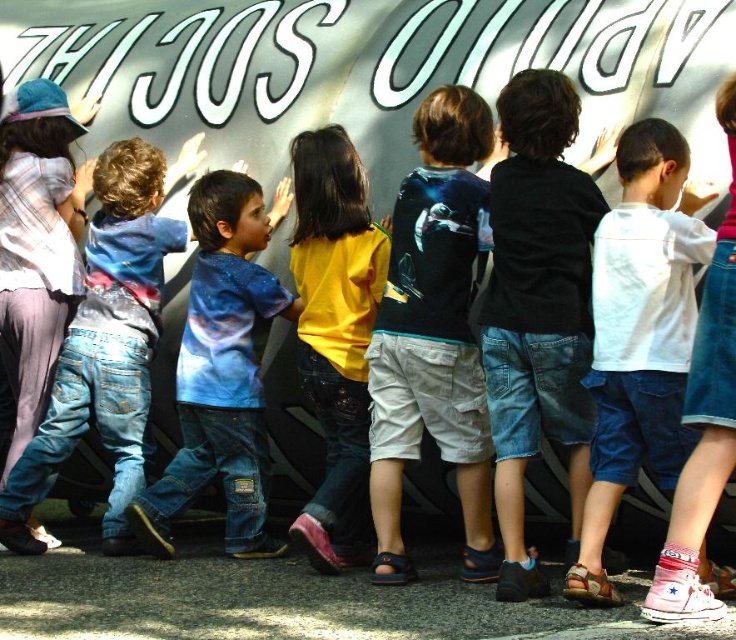
Question: Among these objects, which one is farthest from the camera?

Choices:
 (A) plaid shirt at left
 (B) dark blue t-shirt at center

Answer: (A)

Question: Where is white cotton shirt at center located in relation to denim jeans at left in the image?

Choices:
 (A) left
 (B) right

Answer: (B)

Question: Does white cotton shirt at center lie in front of blue galaxy print shirt at center?

Choices:
 (A) yes
 (B) no

Answer: (A)

Question: Which of the following is the farthest from the observer?

Choices:
 (A) (500, 520)
 (B) (56, 272)

Answer: (B)

Question: Can you confirm if blue galaxy print shirt at center is positioned above plaid shirt at left?

Choices:
 (A) no
 (B) yes

Answer: (A)

Question: Estimate the real-world distances between objects in this image. Which object is farther from the blue galaxy print shirt at center?

Choices:
 (A) dark blue t-shirt at center
 (B) plaid shirt at left

Answer: (B)